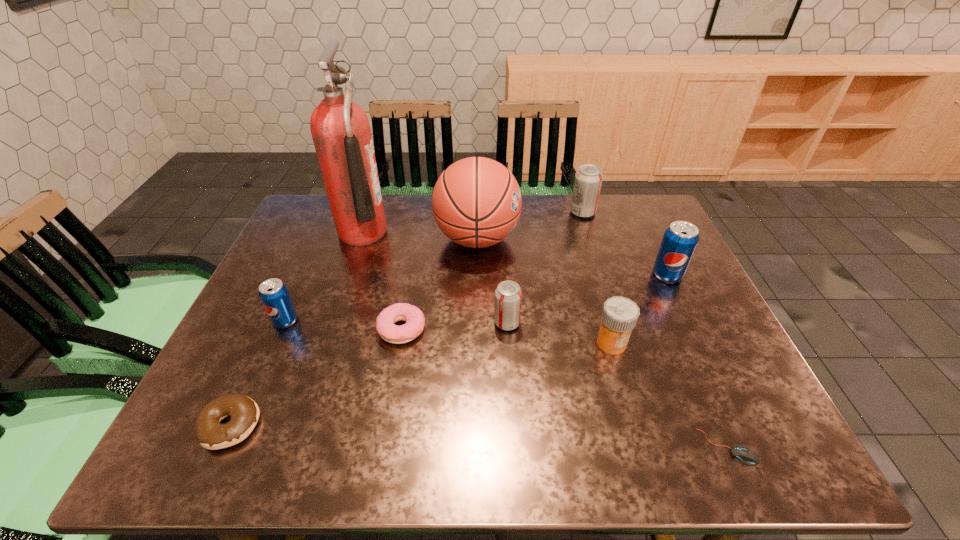
Locate an element on the screen. vacant space that's between the leftmost soda can and the farther gray soda can is located at coordinates (434, 266).

This screenshot has width=960, height=540. Find the location of `free space between the third soda can from right to left and the red fire extinguisher`. free space between the third soda can from right to left and the red fire extinguisher is located at coordinates (435, 278).

Locate an element on the screen. This screenshot has height=540, width=960. free space between the second soda can from left to right and the rightmost soda can is located at coordinates (588, 299).

At what (x,y) coordinates should I click in order to perform the action: click on free space that is in between the orange medicine and the farther gray soda can. Please return your answer as a coordinate pair (x, y). The height and width of the screenshot is (540, 960). Looking at the image, I should click on (597, 278).

You are a GUI agent. You are given a task and a screenshot of the screen. Output one action in this format:
    pyautogui.click(x=<x>, y=<y>)
    Task: Click on the vacant space in between the smaller gray soda can and the black mouse
    The image size is (960, 540).
    Given the screenshot: What is the action you would take?
    pyautogui.click(x=617, y=385)

You are a GUI agent. You are given a task and a screenshot of the screen. Output one action in this format:
    pyautogui.click(x=<x>, y=<y>)
    Task: Click on the free space between the bigger gray soda can and the black mouse
    This screenshot has height=540, width=960.
    Given the screenshot: What is the action you would take?
    pyautogui.click(x=655, y=329)

Where is `vacant space in between the leftmost soda can and the orange medicine`? This screenshot has width=960, height=540. vacant space in between the leftmost soda can and the orange medicine is located at coordinates (448, 332).

You are a GUI agent. You are given a task and a screenshot of the screen. Output one action in this format:
    pyautogui.click(x=<x>, y=<y>)
    Task: Click on the object that stands as the seventh closest to the second soda can from right to left
    Image resolution: width=960 pixels, height=540 pixels.
    Given the screenshot: What is the action you would take?
    pyautogui.click(x=746, y=455)

You are a GUI agent. You are given a task and a screenshot of the screen. Output one action in this format:
    pyautogui.click(x=<x>, y=<y>)
    Task: Click on the closest object to the nearer doughnut
    This screenshot has height=540, width=960.
    Given the screenshot: What is the action you would take?
    pyautogui.click(x=274, y=295)

Identify which soda can is located as the nearest to the third nearest soda can. Please provide its 2D coordinates. Your answer should be formatted as a tuple, i.e. [(x, y)], where the tuple contains the x and y coordinates of a point satisfying the conditions above.

[(588, 180)]